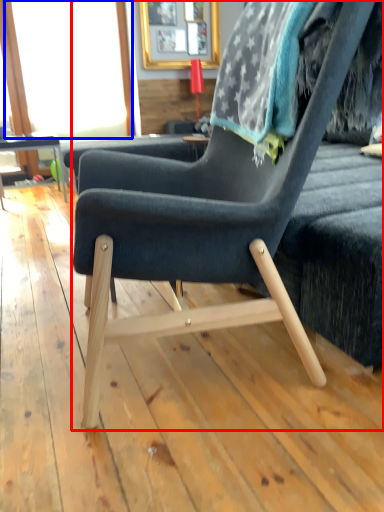
Question: Which of the following is the closest to the observer, chair (highlighted by a red box) or window screen (highlighted by a blue box)?

Choices:
 (A) chair
 (B) window screen

Answer: (A)